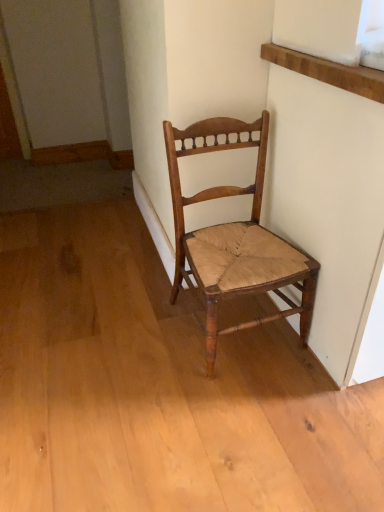
Image resolution: width=384 pixels, height=512 pixels. I want to click on vacant space positioned to the left of natural wood chair at center, so click(137, 340).